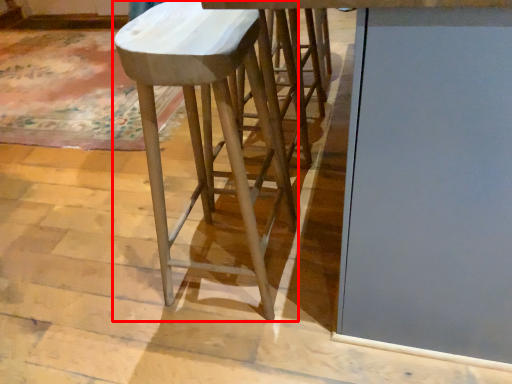
Question: From the image's perspective, where is stool (annotated by the red box) located relative to glass door?

Choices:
 (A) below
 (B) above

Answer: (A)